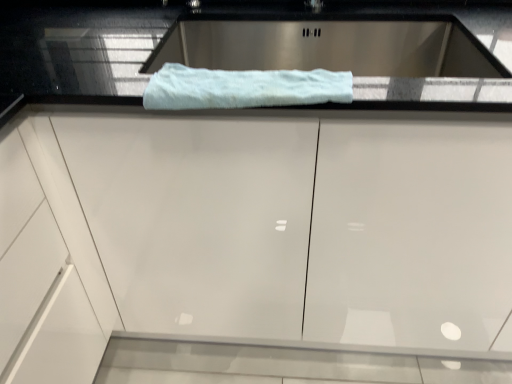
Question: Considering the relative positions of white glossy cabinet at center and white fluffy towel at center in the image provided, is white glossy cabinet at center to the left or to the right of white fluffy towel at center?

Choices:
 (A) right
 (B) left

Answer: (A)

Question: Considering the positions of point (115, 326) and point (147, 107), is point (115, 326) closer or farther from the camera than point (147, 107)?

Choices:
 (A) closer
 (B) farther

Answer: (B)

Question: From the image's perspective, is white glossy cabinet at center positioned above or below white fluffy towel at center?

Choices:
 (A) above
 (B) below

Answer: (B)

Question: From a real-world perspective, is white fluffy towel at center above or below white glossy cabinet at center?

Choices:
 (A) below
 (B) above

Answer: (B)

Question: In terms of width, does white fluffy towel at center look wider or thinner when compared to white glossy cabinet at center?

Choices:
 (A) thin
 (B) wide

Answer: (A)

Question: In the image, is white fluffy towel at center positioned in front of or behind white glossy cabinet at center?

Choices:
 (A) behind
 (B) front

Answer: (A)

Question: In terms of height, does white fluffy towel at center look taller or shorter compared to white glossy cabinet at center?

Choices:
 (A) short
 (B) tall

Answer: (A)